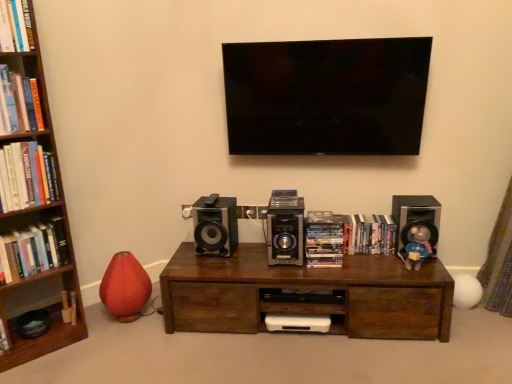
Question: Visually, is wooden bookcase at left positioned to the left or to the right of shiny plastic dvds at center, which is the fifth book from left to right?

Choices:
 (A) right
 (B) left

Answer: (B)

Question: Is wooden bookcase at left taller or shorter than shiny plastic dvds at center, the 2th book viewed from the right?

Choices:
 (A) short
 (B) tall

Answer: (B)

Question: Considering the real-world distances, which object is closest to the brown wood table at center?

Choices:
 (A) hardcover books at left, which appears as the 1th book when viewed from the left
 (B) metallic silver speaker at center, arranged as the 2th speaker when viewed from the left
 (C) satin black speaker at left, the 3th speaker positioned from the right
 (D) wooden bookcase at left
 (E) hardcover books at left, positioned as the fourth book in right-to-left order

Answer: (B)

Question: Which of these objects is positioned farthest from the wooden bookcase at left?

Choices:
 (A) hardcover book at left, which is the 5th book in right-to-left order
 (B) brown wood table at center
 (C) hardcover books at center, which appears as the 6th book when viewed from the left
 (D) hardcover book at upper left, the 3th book positioned from the right
 (E) hardcover books at left, which appears as the 1th book when viewed from the left

Answer: (C)